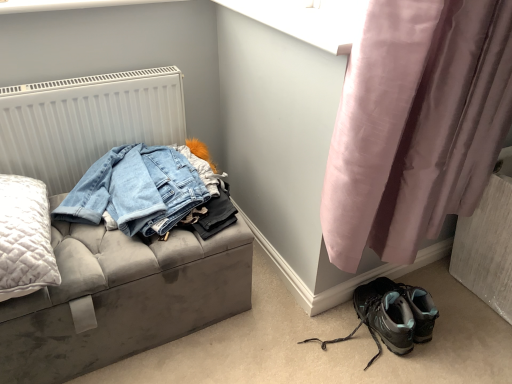
Locate an element on the screen. This screenshot has width=512, height=384. vacant space in matte black hiking boots at lower right (from a real-world perspective) is located at coordinates (344, 343).